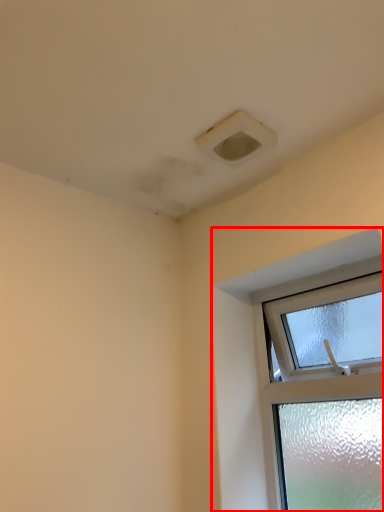
Question: In this image, where is window (annotated by the red box) located relative to air conditioning?

Choices:
 (A) right
 (B) left

Answer: (A)